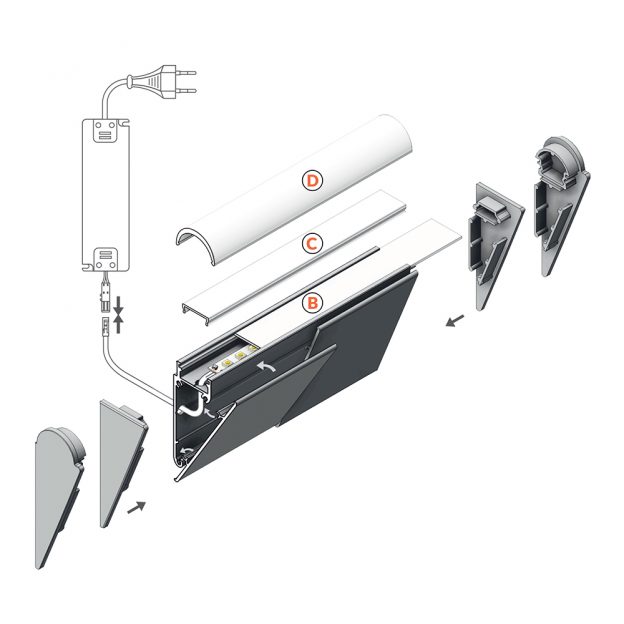
Identify the location of electrical box. Image resolution: width=624 pixels, height=624 pixels. (110, 178).